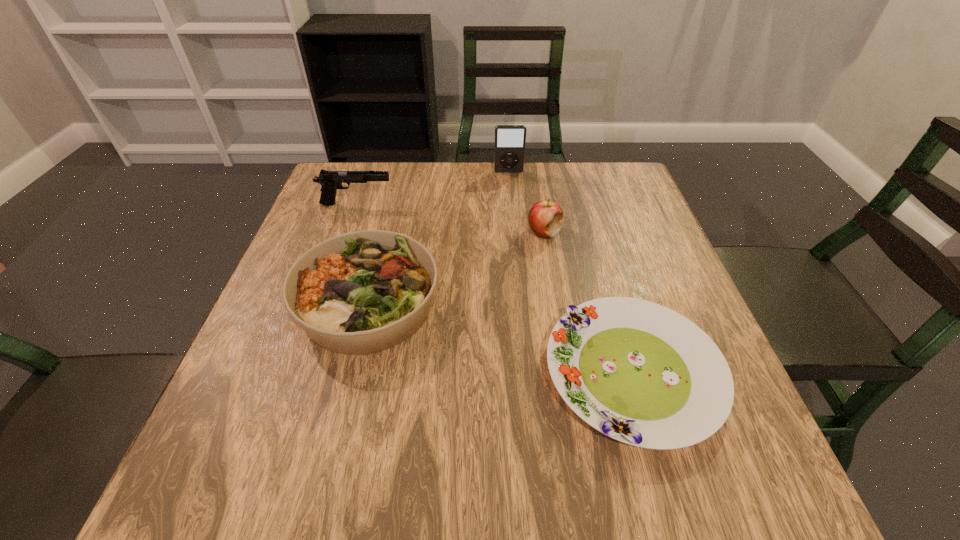
Where is `vacant space that satisfies the following two spatial constraints: 1. at the aiming end of the gun; 2. on the left side of the taller salad plate`? The image size is (960, 540). vacant space that satisfies the following two spatial constraints: 1. at the aiming end of the gun; 2. on the left side of the taller salad plate is located at coordinates (322, 303).

You are a GUI agent. You are given a task and a screenshot of the screen. Output one action in this format:
    pyautogui.click(x=<x>, y=<y>)
    Task: Click on the vacant space that satisfies the following two spatial constraints: 1. at the aiming end of the right salad plate; 2. on the right side of the gun
    This screenshot has height=540, width=960.
    Given the screenshot: What is the action you would take?
    pyautogui.click(x=298, y=373)

This screenshot has width=960, height=540. In order to click on vacant space that satisfies the following two spatial constraints: 1. on the front-facing side of the farthest object; 2. on the left side of the shortest object in this screenshot , I will do `click(526, 373)`.

Identify the location of vacant region that satisfies the following two spatial constraints: 1. on the front-facing side of the apple; 2. on the right side of the iPod. (514, 233).